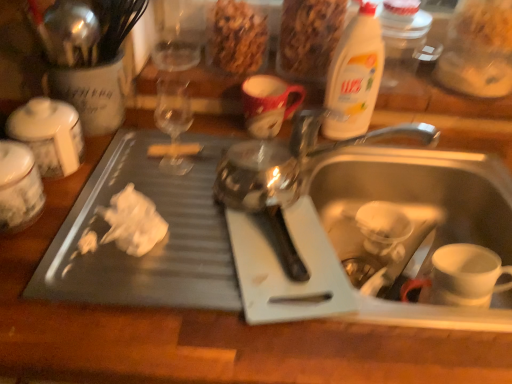
The image size is (512, 384). In order to click on free space in front of white plastic bottle at upper right in this screenshot , I will do `click(341, 153)`.